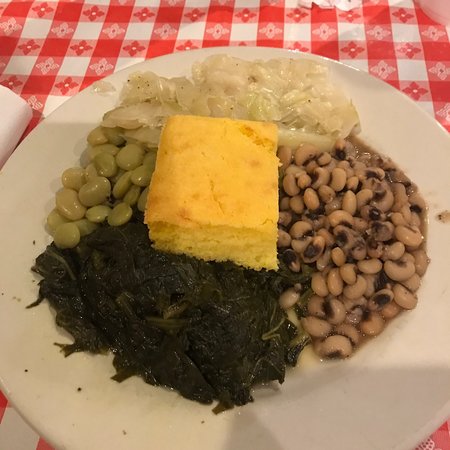
Where is `napkin`? napkin is located at coordinates (12, 115).